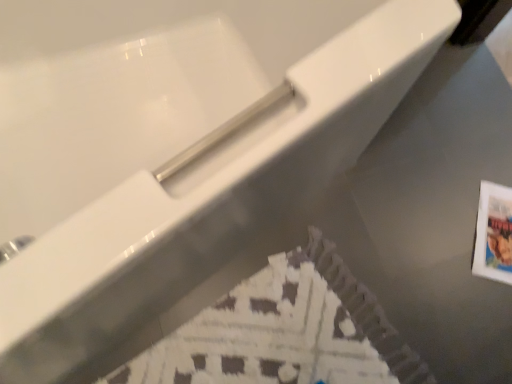
Question: Considering the positions of point pos(315,286) and point pos(507,248), is point pos(315,286) closer or farther from the camera than point pos(507,248)?

Choices:
 (A) farther
 (B) closer

Answer: (B)

Question: Which is correct: white paper flyer at lower center is inside printed paper postcard at lower right, or outside of it?

Choices:
 (A) outside
 (B) inside

Answer: (A)

Question: Is white paper flyer at lower center bigger or smaller than printed paper postcard at lower right?

Choices:
 (A) small
 (B) big

Answer: (B)

Question: Is point (482, 258) closer or farther from the camera than point (224, 332)?

Choices:
 (A) closer
 (B) farther

Answer: (B)

Question: In terms of size, does printed paper postcard at lower right appear bigger or smaller than white paper flyer at lower center?

Choices:
 (A) small
 (B) big

Answer: (A)

Question: In the image, is printed paper postcard at lower right positioned in front of or behind white paper flyer at lower center?

Choices:
 (A) front
 (B) behind

Answer: (B)

Question: Would you say printed paper postcard at lower right is to the left or to the right of white paper flyer at lower center in the picture?

Choices:
 (A) left
 (B) right

Answer: (B)